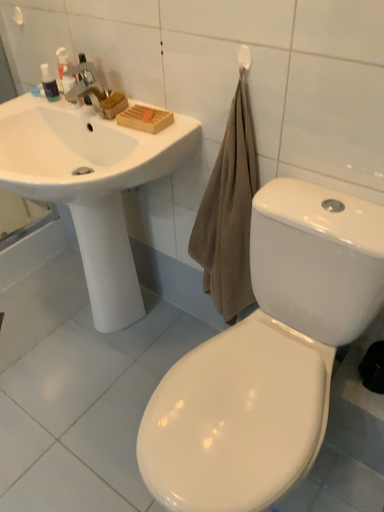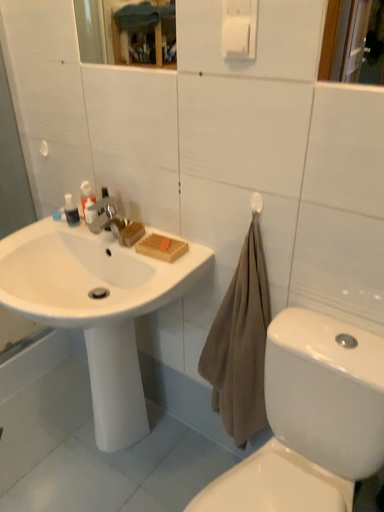
Question: Which way did the camera rotate in the video?

Choices:
 (A) rotated downward
 (B) rotated upward

Answer: (B)